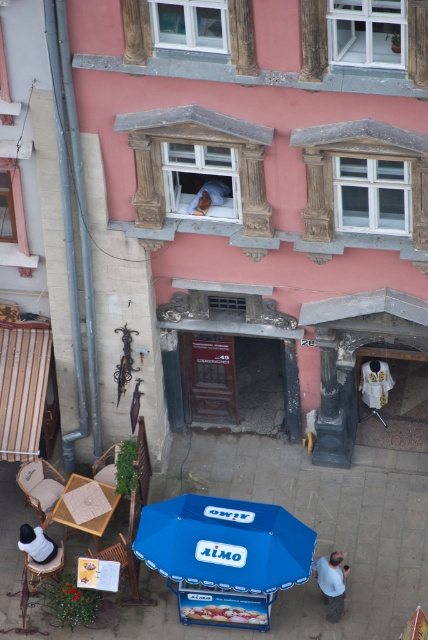
You are planning to place the light brown leather jacket at lower center on the light brown woven chair at lower left. Based on their sizes, will the jacket fit on the chair without hanging off the edges?

The light brown woven chair at lower left might be wider than the light brown leather jacket at lower center, so there is a possibility that the jacket will fit without hanging off the edges, but the exact fit depends on the chair and jacket dimensions.

You are standing at the origin point of the coordinate system. The light brown woven chair at lower left is located at point 0.759, 0.093. If you want to walk straight towards it, which direction should you face?

To reach the light brown woven chair at lower left located at point [39,484] from the origin, you should face the direction corresponding to the coordinates [39,484], which would be towards the lower left direction.

You are standing at the entrance of the pink building and want to place a new potted plant with red flowers exactly where the blue fabric umbrella at lower center is currently located. Is this possible? Please explain based on the scene description.

The blue fabric umbrella at lower center is located at point coordinates (225, 541). Since the potted plant with red flowers is currently near the table, you can move it to the specified coordinates where the blue fabric umbrella at lower center is placed.